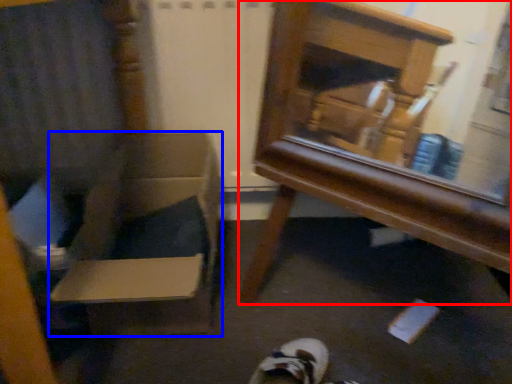
Question: Which object is closer to the camera taking this photo, furniture (highlighted by a red box) or cardboard box (highlighted by a blue box)?

Choices:
 (A) furniture
 (B) cardboard box

Answer: (A)